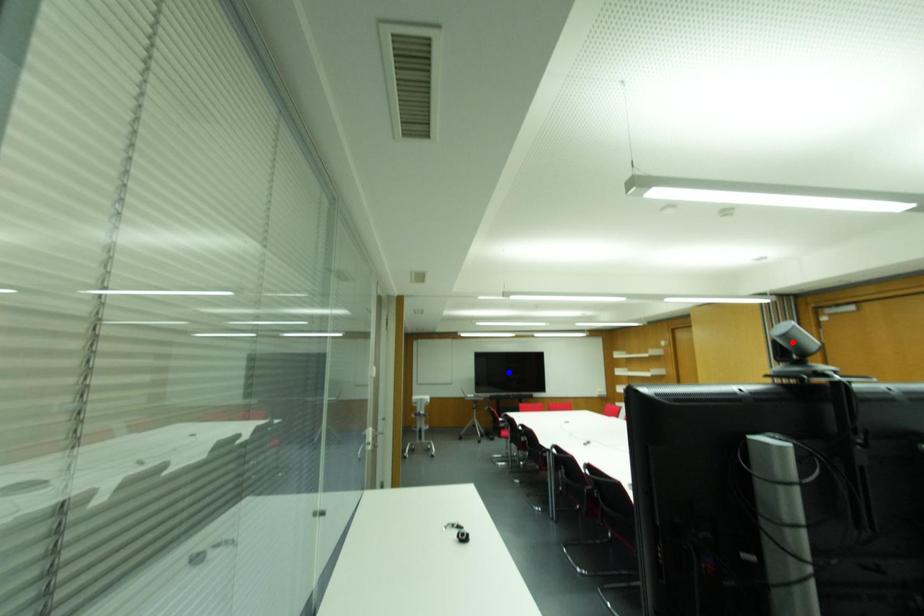
Question: Two points are marked on the image. Which point is closer to the camera?

Choices:
 (A) Blue point is closer.
 (B) Red point is closer.

Answer: (B)